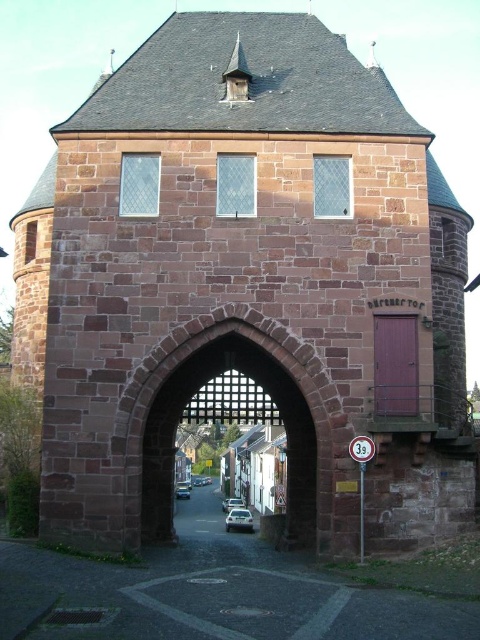
Who is positioned more to the left, reddish stone archway at center or shiny silver car at center?

Positioned to the left is shiny silver car at center.

Is reddish stone archway at center shorter than shiny silver car at center?

No, reddish stone archway at center is not shorter than shiny silver car at center.

Image resolution: width=480 pixels, height=640 pixels. In order to click on reddish stone archway at center in this screenshot , I will do `click(273, 397)`.

Where is `reddish stone archway at center`? This screenshot has width=480, height=640. reddish stone archway at center is located at coordinates (273, 397).

Can you confirm if reddish stone archway at center is smaller than white glossy car at center?

Incorrect, reddish stone archway at center is not smaller in size than white glossy car at center.

Who is taller, reddish stone archway at center or white glossy car at center?

Standing taller between the two is reddish stone archway at center.

Who is more forward, (132, 516) or (251, 529)?

Point (132, 516) is in front.

In order to click on reddish stone archway at center in this screenshot , I will do `click(273, 397)`.

Who is positioned more to the left, brown stone alley at center or silver metallic car at center?

silver metallic car at center is more to the left.

The width and height of the screenshot is (480, 640). In order to click on brown stone alley at center in this screenshot , I will do `click(210, 595)`.

Who is more forward, (69, 614) or (239, 497)?

Point (69, 614)

What are the coordinates of `brown stone alley at center` in the screenshot? It's located at (210, 595).